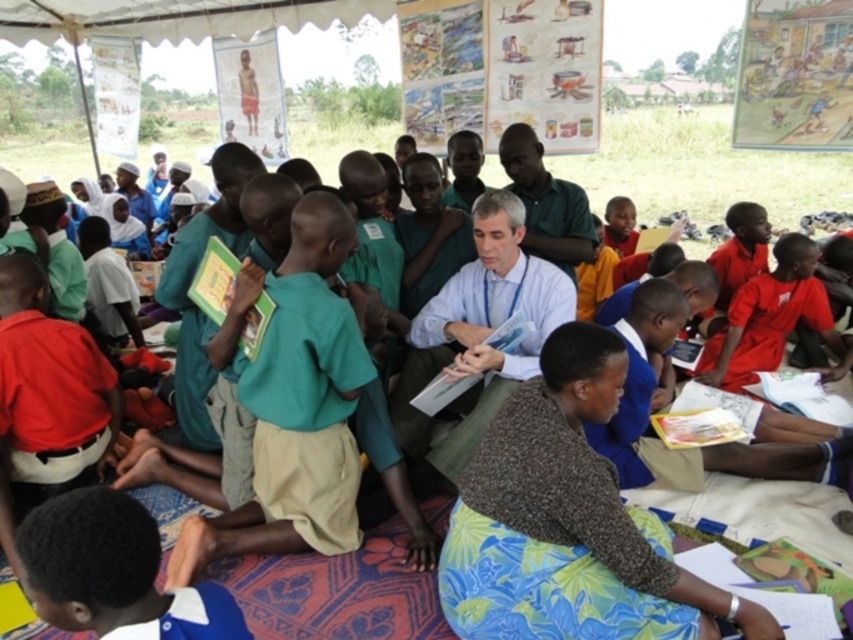
Question: Which object is the closest to the green fabric shirt at center?

Choices:
 (A) red cotton shirt at right
 (B) light blue shirt at center

Answer: (B)

Question: Is light blue shirt at center above red cotton shirt at right?

Choices:
 (A) no
 (B) yes

Answer: (B)

Question: Does light blue shirt at center have a smaller size compared to red cotton shirt at right?

Choices:
 (A) no
 (B) yes

Answer: (A)

Question: Which of the following is the farthest from the observer?

Choices:
 (A) red cotton shirt at right
 (B) light blue shirt at center
 (C) green fabric shirt at center

Answer: (A)

Question: Does light blue shirt at center lie behind green fabric shirt at center?

Choices:
 (A) no
 (B) yes

Answer: (A)

Question: Which of the following is the farthest from the observer?

Choices:
 (A) (430, 298)
 (B) (769, 333)

Answer: (B)